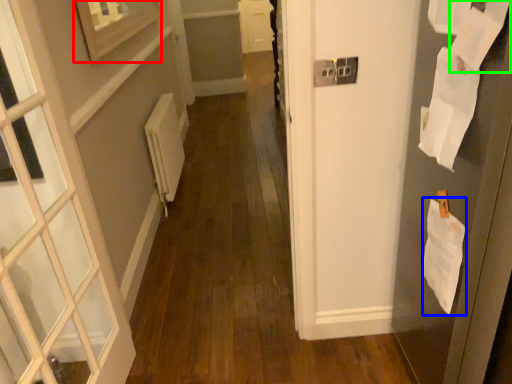
Question: Estimate the real-world distances between objects in this image. Which object is closer to picture frame (highlighted by a red box), paper (highlighted by a blue box) or paper (highlighted by a green box)?

Choices:
 (A) paper
 (B) paper

Answer: (B)